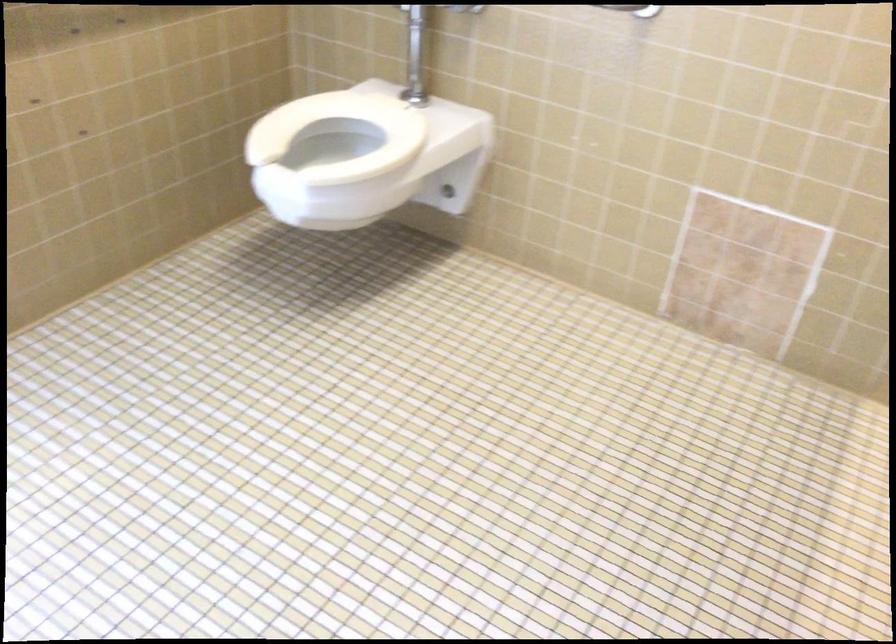
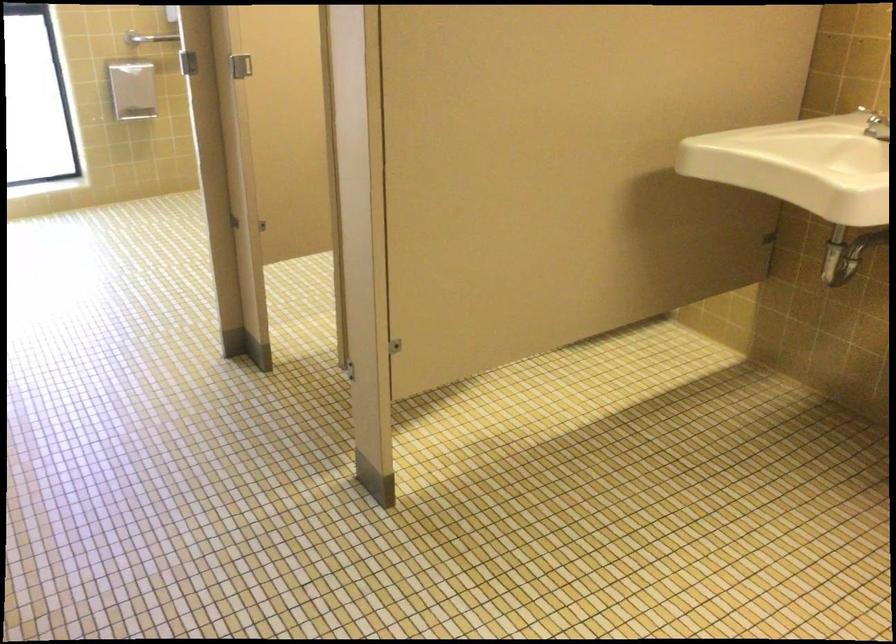
Question: I am providing you with two images of the same scene from different viewpoints. Please identify which objects are invisible in image2.

Choices:
 (A) green plastic cylinder
 (B) silver faucet handle
 (C) metal stall latch
 (D) metal grab bar

Answer: (D)